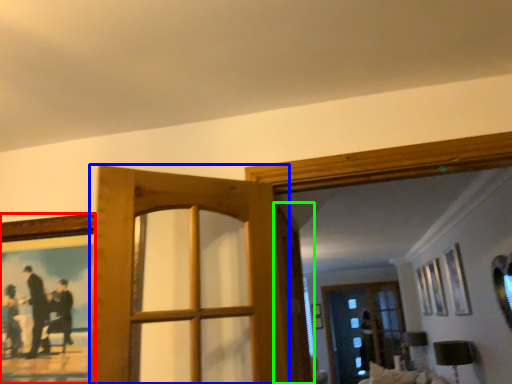
Question: Estimate the real-world distances between objects in this image. Which object is farther from picture frame (highlighted by a red box), door (highlighted by a blue box) or screen door (highlighted by a green box)?

Choices:
 (A) door
 (B) screen door

Answer: (B)